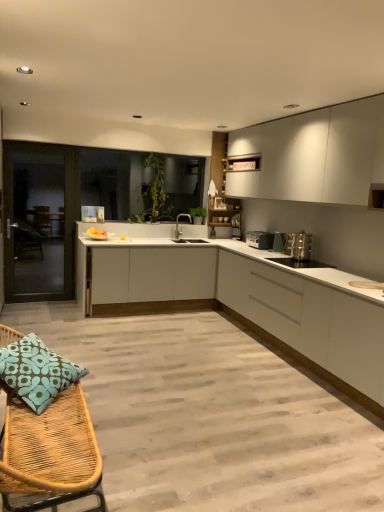
Question: Is satin nickel faucet at center taller or shorter than transparent glass door at left?

Choices:
 (A) tall
 (B) short

Answer: (B)

Question: From a real-world perspective, is satin nickel faucet at center positioned above or below transparent glass door at left?

Choices:
 (A) below
 (B) above

Answer: (B)

Question: Which object is positioned farthest from the satin silver toaster at right, which appears as the 2th appliance when viewed from the back?

Choices:
 (A) white matte cabinet at center, the 2th cabinetry when ordered from bottom to top
 (B) white matte cabinet at right, arranged as the 1th cabinetry when ordered from the bottom
 (C) satin nickel faucet at center
 (D) transparent glass door at left
 (E) white matte cabinet at upper right, marked as the 3th cabinetry in a bottom-to-top arrangement

Answer: (D)

Question: Which of these objects is positioned closest to the satin silver toaster at right, which ranks as the second appliance in front-to-back order?

Choices:
 (A) transparent glass door at left
 (B) silver metallic toaster at center, which is the third appliance in front-to-back order
 (C) white matte cabinet at center, placed as the 2th cabinetry when sorted from top to bottom
 (D) satin nickel faucet at center
 (E) blue printed cushion at lower left

Answer: (B)